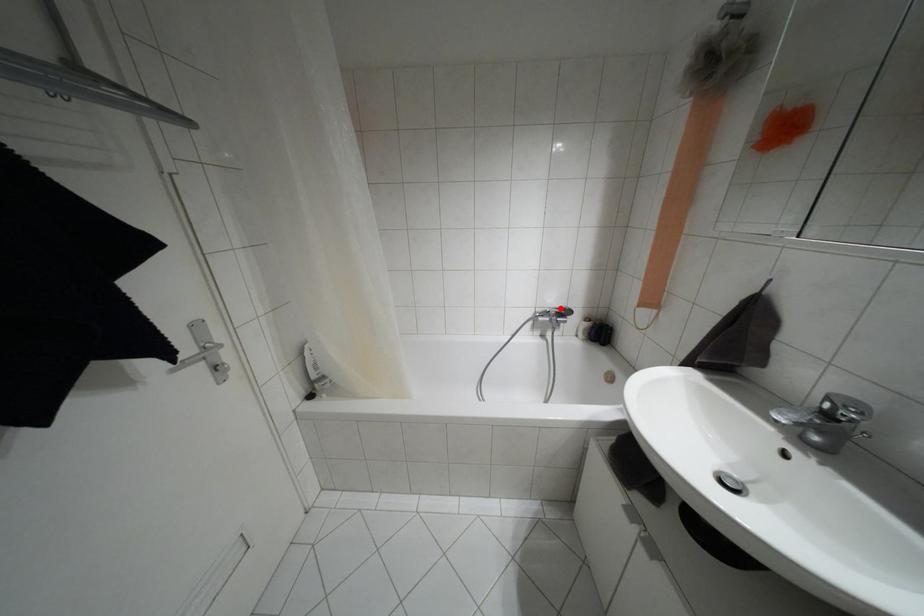
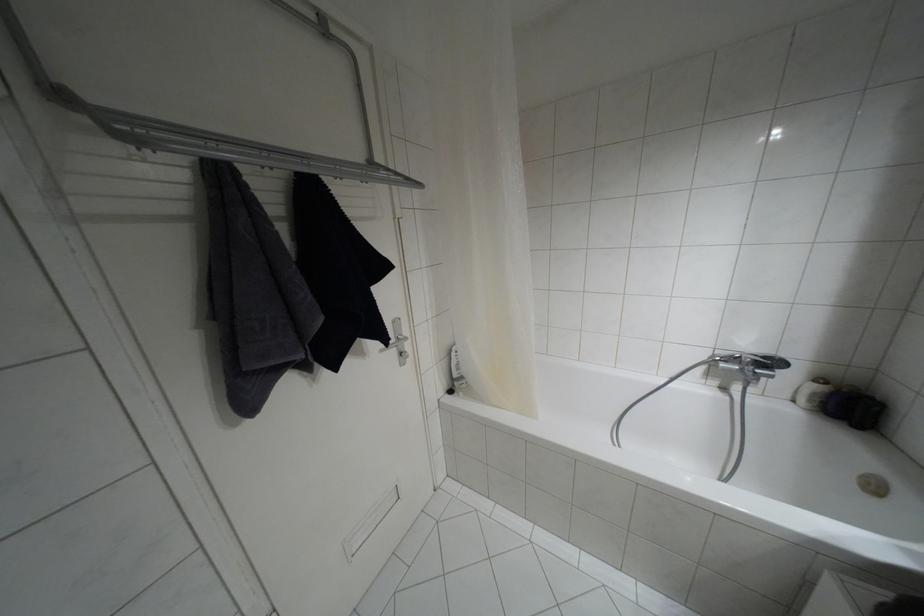
Locate, in the second image, the point that corresponds to the highlighted location in the first image.

(763, 357)